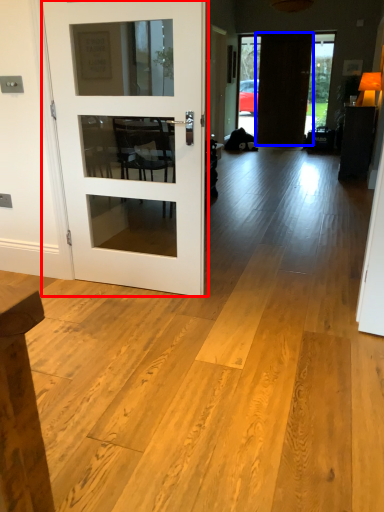
Question: Which object appears farthest to the camera in this image, door (highlighted by a red box) or door (highlighted by a blue box)?

Choices:
 (A) door
 (B) door

Answer: (B)